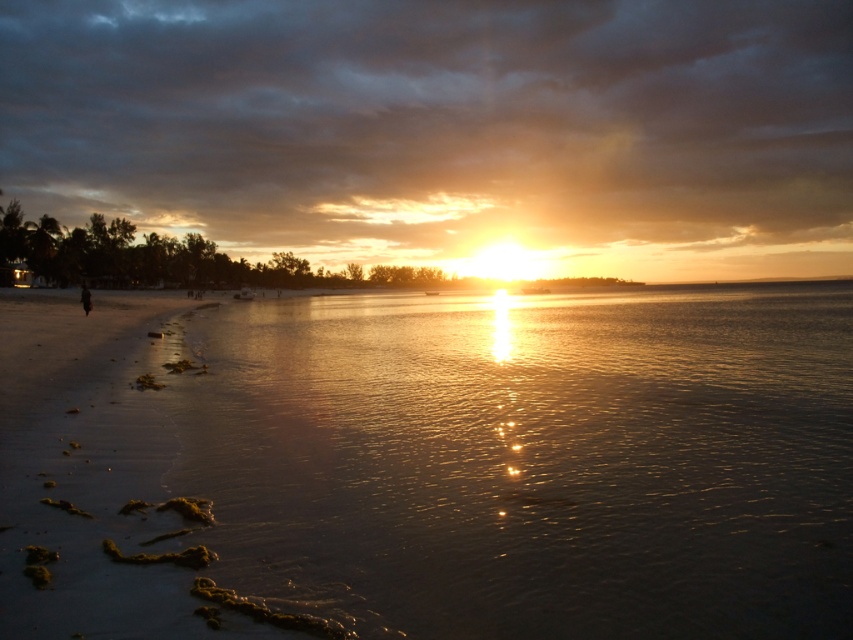
You are a photographer trying to capture the sunset reflection on the beach. You have a camera with a fixed 35mm lens. The glistening water at center and dark hair at left are both in your frame. Which object will appear wider in the photo?

The glistening water at center will appear wider in the photo because its width is larger than the dark hair at left according to the description.

You are a photographer trying to capture the sunset. You notice the glistening water at center and dark hair at left in your frame. Which object should you focus on to ensure it takes up more space in your photo?

The glistening water at center should be focused on because it is larger in size than the dark hair at left, making it the better choice for taking up more space in the photo.